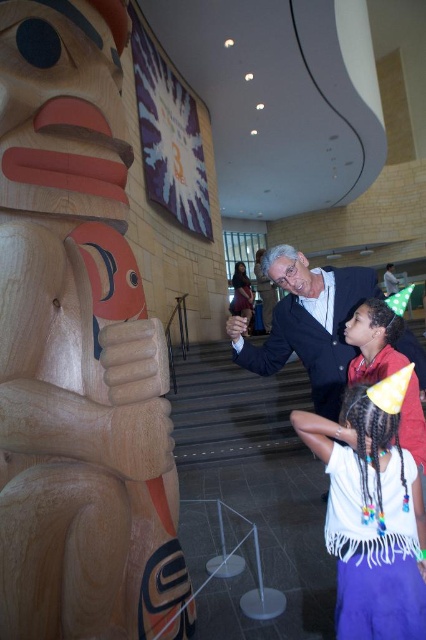
Question: Considering the real-world distances, which object is farthest from the white fringed shirt at lower center?

Choices:
 (A) natural wood totem pole at left
 (B) smooth navy suit at center

Answer: (B)

Question: Is natural wood totem pole at left thinner than white fringed shirt at lower center?

Choices:
 (A) yes
 (B) no

Answer: (B)

Question: Which point is closer to the camera?

Choices:
 (A) smooth navy suit at center
 (B) white fringed shirt at lower center
 (C) natural wood totem pole at left

Answer: (C)

Question: Is white fringed shirt at lower center bigger than smooth navy suit at center?

Choices:
 (A) yes
 (B) no

Answer: (B)

Question: Can you confirm if natural wood totem pole at left is positioned to the right of white fringed shirt at lower center?

Choices:
 (A) no
 (B) yes

Answer: (A)

Question: Estimate the real-world distances between objects in this image. Which object is farther from the smooth navy suit at center?

Choices:
 (A) white fringed shirt at lower center
 (B) natural wood totem pole at left

Answer: (B)